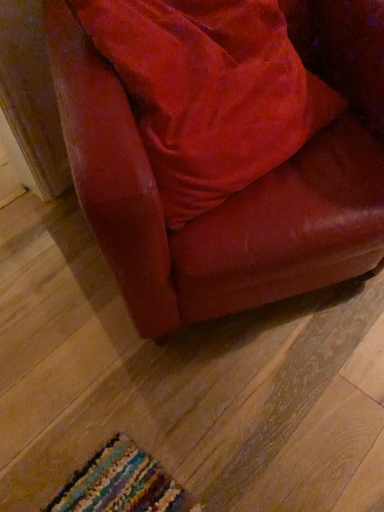
Find the location of a particular element. Image resolution: width=384 pixels, height=512 pixels. vacant area in front of velvet red armchair at center is located at coordinates (225, 418).